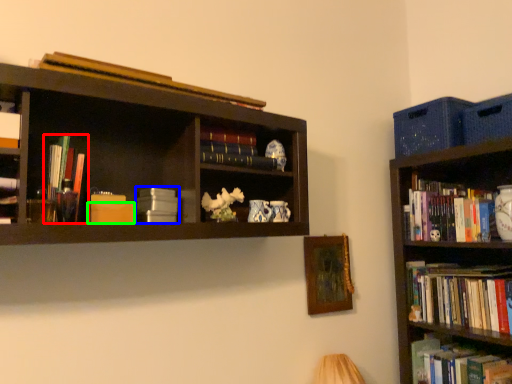
Question: Which object is the closest to the book (highlighted by a red box)? Choose among these: book (highlighted by a blue box) or paperback book (highlighted by a green box).

Choices:
 (A) book
 (B) paperback book

Answer: (B)